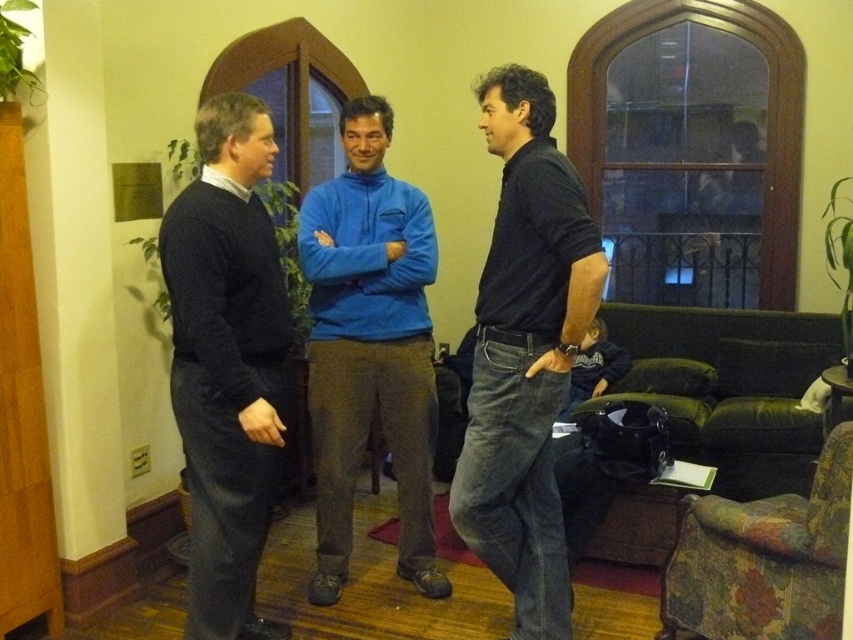
You are a photographer setting up a shoot in the living room. You need to decide where to place a new lamp. The lamp is supposed to be placed on the floor near the dark blue jeans at center but not on the multicolored fabric armchair at lower right. Is this possible?

The dark blue jeans at center is positioned over the multicolored fabric armchair at lower right. Therefore, placing the lamp on the floor near the dark blue jeans at center would mean placing it near the multicolored fabric armchair at lower right, but since the jeans are on the chair, the lamp can be placed on the floor next to the chair, avoiding the chair itself.